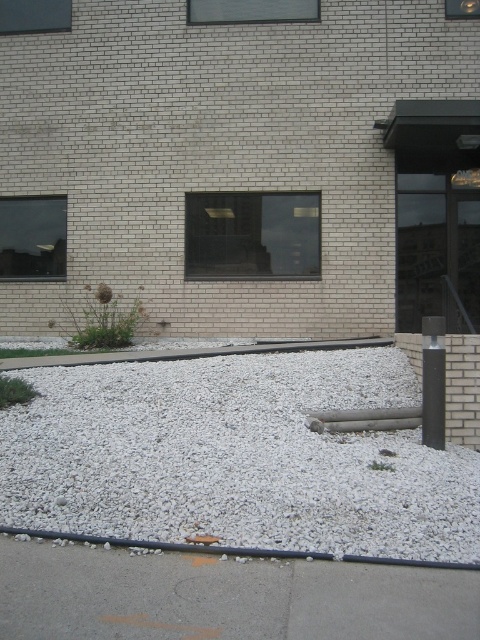
You are a delivery person approaching the building and need to place a package on the ground near the black rubber curb at lower center and the black polished pole at right. Which object should you place the package closer to if you want it to be as close as possible to both objects?

The black rubber curb at lower center is positioned on the left side of black polished pole at right, so placing the package between them would be closest to both objects.

You are a delivery person with a heavy box that needs to be placed on the ground near the building. You have to choose between placing it on the white gravel at lower center or the gray concrete curb at center. Which surface can support the weight better?

The gray concrete curb at center is more durable and can support heavier weights compared to the white gravel at lower center, which is made of smaller, less stable materials.